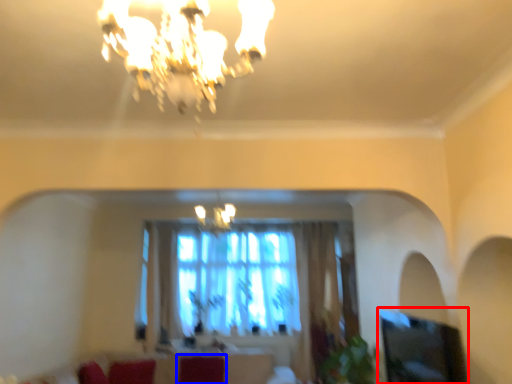
Question: Which of the following is the closest to the observer, window screen (highlighted by a red box) or swivel chair (highlighted by a blue box)?

Choices:
 (A) window screen
 (B) swivel chair

Answer: (A)